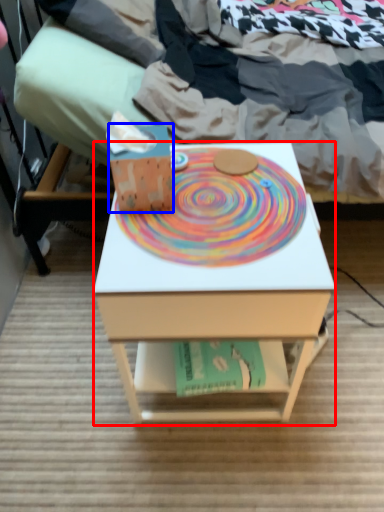
Question: Which object appears closest to the camera in this image, desk (highlighted by a red box) or box (highlighted by a blue box)?

Choices:
 (A) desk
 (B) box

Answer: (A)